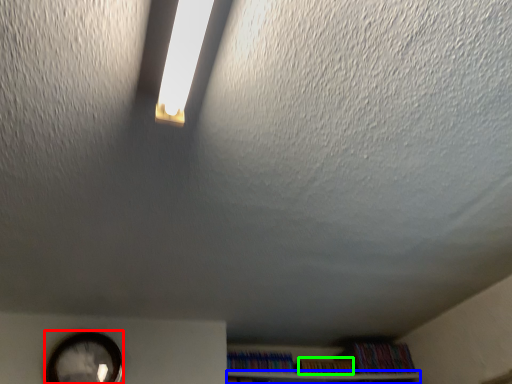
Question: Which is nearer to the clock (highlighted by a red box)? shelf (highlighted by a blue box) or book (highlighted by a green box).

Choices:
 (A) shelf
 (B) book

Answer: (A)